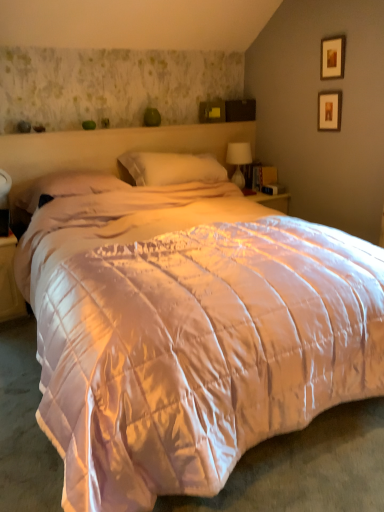
Question: Considering the relative positions of matte white nightstand at lower left and white soft pillow at center, positioned as the 2th pillow in left-to-right order, in the image provided, is matte white nightstand at lower left to the left of white soft pillow at center, positioned as the 2th pillow in left-to-right order, from the viewer's perspective?

Choices:
 (A) yes
 (B) no

Answer: (A)

Question: Considering the relative positions of matte white nightstand at lower left and white soft pillow at center, the 1th pillow when ordered from right to left, in the image provided, is matte white nightstand at lower left to the right of white soft pillow at center, the 1th pillow when ordered from right to left, from the viewer's perspective?

Choices:
 (A) no
 (B) yes

Answer: (A)

Question: Is matte white nightstand at lower left smaller than white soft pillow at center, the 1th pillow when ordered from right to left?

Choices:
 (A) yes
 (B) no

Answer: (A)

Question: From the image's perspective, is matte white nightstand at lower left on top of white soft pillow at center, positioned as the 2th pillow in left-to-right order?

Choices:
 (A) no
 (B) yes

Answer: (A)

Question: Is matte white nightstand at lower left taller than white soft pillow at center, positioned as the 2th pillow in left-to-right order?

Choices:
 (A) no
 (B) yes

Answer: (B)

Question: Relative to pink satin pillow at center, which is counted as the 1th pillow, starting from the left, is white soft pillow at center, the 1th pillow when ordered from right to left, in front or behind?

Choices:
 (A) behind
 (B) front

Answer: (A)

Question: Is white soft pillow at center, the 1th pillow when ordered from right to left, inside the boundaries of pink satin pillow at center, which is counted as the 1th pillow, starting from the left, or outside?

Choices:
 (A) outside
 (B) inside

Answer: (A)

Question: Considering the positions of white soft pillow at center, positioned as the 2th pillow in left-to-right order, and pink satin pillow at center, which is counted as the 1th pillow, starting from the left, in the image, is white soft pillow at center, positioned as the 2th pillow in left-to-right order, taller or shorter than pink satin pillow at center, which is counted as the 1th pillow, starting from the left,?

Choices:
 (A) tall
 (B) short

Answer: (A)

Question: From a real-world perspective, is white soft pillow at center, the 1th pillow when ordered from right to left, positioned above or below pink satin pillow at center, which is counted as the 1th pillow, starting from the left?

Choices:
 (A) below
 (B) above

Answer: (B)

Question: In the image, is wooden picture frame at upper right, arranged as the second picture frame when viewed from the top, positioned in front of or behind white soft pillow at center, positioned as the 2th pillow in left-to-right order?

Choices:
 (A) front
 (B) behind

Answer: (B)

Question: From a real-world perspective, is wooden picture frame at upper right, arranged as the second picture frame when viewed from the top, positioned above or below white soft pillow at center, the 1th pillow when ordered from right to left?

Choices:
 (A) below
 (B) above

Answer: (B)

Question: Is wooden picture frame at upper right, acting as the first picture frame starting from the bottom, to the left or to the right of white soft pillow at center, the 1th pillow when ordered from right to left, in the image?

Choices:
 (A) right
 (B) left

Answer: (A)

Question: Is wooden picture frame at upper right, acting as the first picture frame starting from the bottom, taller or shorter than white soft pillow at center, the 1th pillow when ordered from right to left?

Choices:
 (A) tall
 (B) short

Answer: (B)

Question: Looking at their shapes, would you say translucent glass table lamp at upper right is wider or thinner than wooden picture frame at upper right, which appears as the 1th picture frame when viewed from the top?

Choices:
 (A) wide
 (B) thin

Answer: (A)

Question: In the image, is translucent glass table lamp at upper right on the left side or the right side of wooden picture frame at upper right, which appears as the 1th picture frame when viewed from the top?

Choices:
 (A) left
 (B) right

Answer: (A)